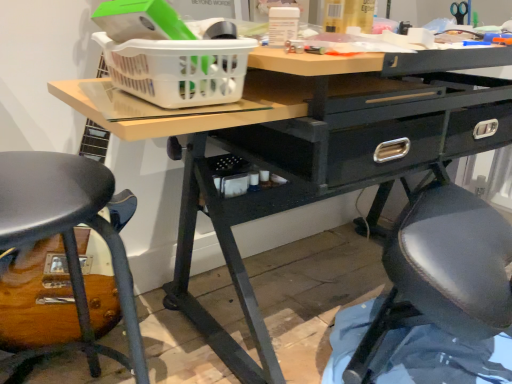
What do you see at coordinates (69, 233) in the screenshot? This screenshot has height=384, width=512. I see `matte black stool at lower left` at bounding box center [69, 233].

Locate an element on the screen. The height and width of the screenshot is (384, 512). matte black stool at lower left is located at coordinates (69, 233).

Describe the element at coordinates (178, 69) in the screenshot. This screenshot has width=512, height=384. I see `white plastic basket at upper center` at that location.

Locate an element on the screen. Image resolution: width=512 pixels, height=384 pixels. white plastic basket at upper center is located at coordinates (178, 69).

Identify the location of matte black stool at lower left. The width and height of the screenshot is (512, 384). (69, 233).

Considering the positions of objects white plastic basket at upper center and matte black stool at lower left in the image provided, who is more to the right, white plastic basket at upper center or matte black stool at lower left?

Positioned to the right is white plastic basket at upper center.

Which object is closer to the camera, white plastic basket at upper center or matte black stool at lower left?

matte black stool at lower left.

Which is more distant, (187, 86) or (16, 161)?

The point (16, 161) is behind.

Based on the photo, from the image's perspective, is white plastic basket at upper center on matte black stool at lower left?

Yes, from the image's perspective, white plastic basket at upper center is above matte black stool at lower left.

From a real-world perspective, is white plastic basket at upper center located beneath matte black stool at lower left?

Incorrect, from a real-world perspective, white plastic basket at upper center is higher than matte black stool at lower left.

Which object is thinner, white plastic basket at upper center or matte black stool at lower left?

Thinner between the two is white plastic basket at upper center.

Between white plastic basket at upper center and matte black stool at lower left, which one has more height?

matte black stool at lower left is taller.

Considering the sizes of objects white plastic basket at upper center and matte black stool at lower left in the image provided, who is bigger, white plastic basket at upper center or matte black stool at lower left?

Bigger between the two is matte black stool at lower left.

Is matte black stool at lower left inside white plastic basket at upper center?

No.

Is white plastic basket at upper center beside matte black stool at lower left?

No, white plastic basket at upper center is not next to matte black stool at lower left.

Is white plastic basket at upper center facing away from matte black stool at lower left?

That's not correct — white plastic basket at upper center is not looking away from matte black stool at lower left.

Can you tell me how much white plastic basket at upper center and matte black stool at lower left differ in facing direction?

They differ by 4.04 degrees in their facing directions.

Where is `chair that appears in front of the white plastic basket at upper center`? chair that appears in front of the white plastic basket at upper center is located at coordinates (69, 233).

In the image, is matte black stool at lower left on the left side or the right side of white plastic basket at upper center?

In the image, matte black stool at lower left appears on the left side of white plastic basket at upper center.

Between matte black stool at lower left and white plastic basket at upper center, which one is positioned behind?

white plastic basket at upper center.

Does point (72, 234) lie in front of point (186, 86)?

No, (72, 234) is further to viewer.

From the image's perspective, who appears lower, matte black stool at lower left or white plastic basket at upper center?

matte black stool at lower left, from the image's perspective.

From a real-world perspective, is matte black stool at lower left below white plastic basket at upper center?

Correct, in the physical world, matte black stool at lower left is lower than white plastic basket at upper center.

Considering the sizes of matte black stool at lower left and white plastic basket at upper center in the image, is matte black stool at lower left wider or thinner than white plastic basket at upper center?

In the image, matte black stool at lower left appears to be wider than white plastic basket at upper center.

Does matte black stool at lower left have a lesser height compared to white plastic basket at upper center?

Incorrect, the height of matte black stool at lower left does not fall short of that of white plastic basket at upper center.

Is matte black stool at lower left bigger or smaller than white plastic basket at upper center?

matte black stool at lower left is bigger than white plastic basket at upper center.

Is matte black stool at lower left located outside white plastic basket at upper center?

Indeed, matte black stool at lower left is completely outside white plastic basket at upper center.

Are matte black stool at lower left and white plastic basket at upper center beside each other?

There is a gap between matte black stool at lower left and white plastic basket at upper center.

Is matte black stool at lower left facing towards white plastic basket at upper center?

No, matte black stool at lower left is not facing towards white plastic basket at upper center.

How different are the orientations of matte black stool at lower left and white plastic basket at upper center in degrees?

The angle between the facing direction of matte black stool at lower left and the facing direction of white plastic basket at upper center is 4.04 degrees.

The image size is (512, 384). There is a matte black stool at lower left. Identify the location of basket above it (from a real-world perspective). (178, 69).

In order to click on chair directly beneath the white plastic basket at upper center (from a real-world perspective) in this screenshot , I will do (69, 233).

What are the coordinates of `basket on the right of matte black stool at lower left` in the screenshot? It's located at (178, 69).